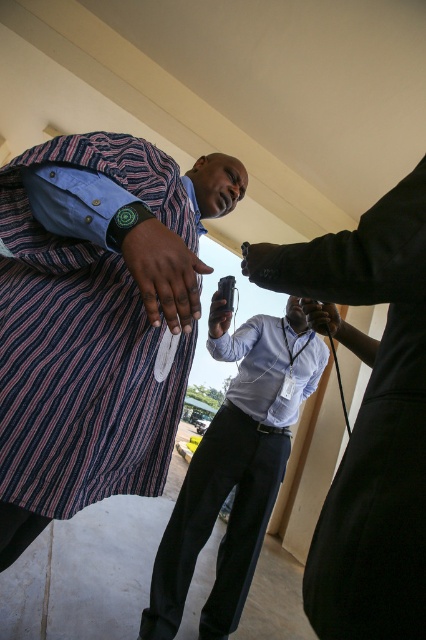
What is the object located at the coordinates point (83, 342)?

The object located at point (83, 342) is the striped fabric dress at center.

You are standing in a room where the matte black suit at upper right is placed. You want to move to the door located at the far end of the room without moving closer than 20 inches to any object. Can you safely move to the door?

The matte black suit at upper right and viewer are 20.88 inches apart. Since the minimum required distance is 20 inches, you can safely move to the door as long as you maintain at least that distance from the matte black suit at upper right.